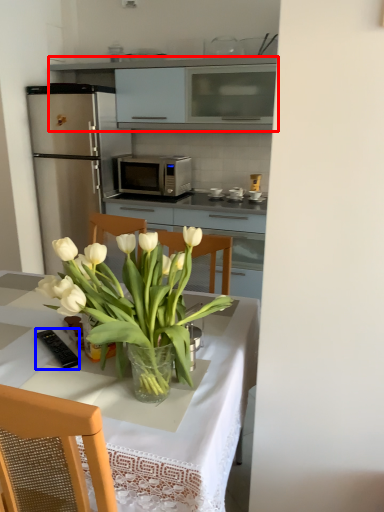
Question: Which object appears closest to the camera in this image, cabinetry (highlighted by a red box) or appliance (highlighted by a blue box)?

Choices:
 (A) cabinetry
 (B) appliance

Answer: (B)